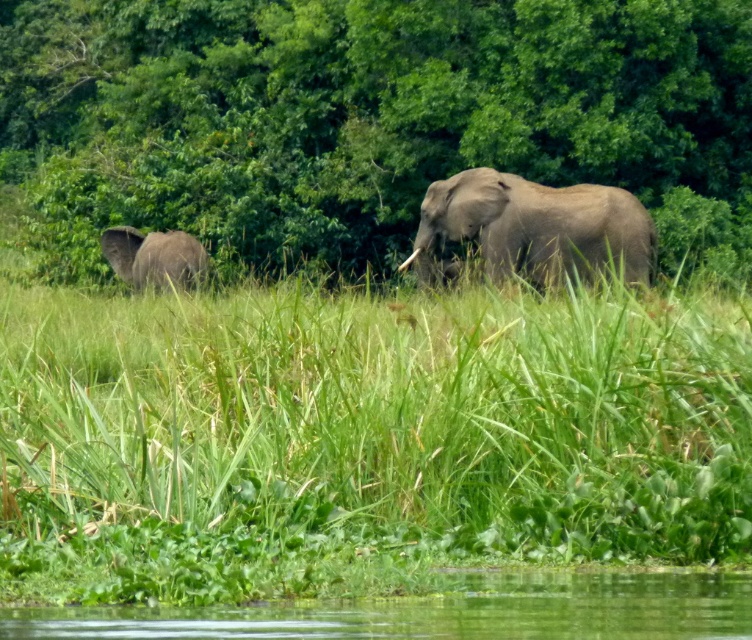
Question: Which point appears farthest from the camera in this image?

Choices:
 (A) (547, 266)
 (B) (153, 186)

Answer: (B)

Question: Can you confirm if green grassy at center is thinner than gray matte elephant at center?

Choices:
 (A) no
 (B) yes

Answer: (A)

Question: Is gray matte elephant at center to the left of white ivory tusk at center from the viewer's perspective?

Choices:
 (A) no
 (B) yes

Answer: (A)

Question: Based on their relative distances, which object is nearer to the white ivory tusk at center?

Choices:
 (A) gray matte elephant at center
 (B) green grassy at center

Answer: (A)

Question: Which point is farther to the camera?

Choices:
 (A) (605, 236)
 (B) (414, 257)

Answer: (B)

Question: Can you confirm if green grassy at center is positioned to the left of white ivory tusk at center?

Choices:
 (A) yes
 (B) no

Answer: (A)